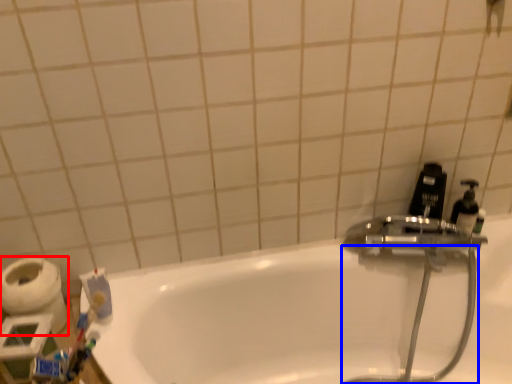
Question: Which object is closer to the camera taking this photo, toilet paper (highlighted by a red box) or garden hose (highlighted by a blue box)?

Choices:
 (A) toilet paper
 (B) garden hose

Answer: (B)